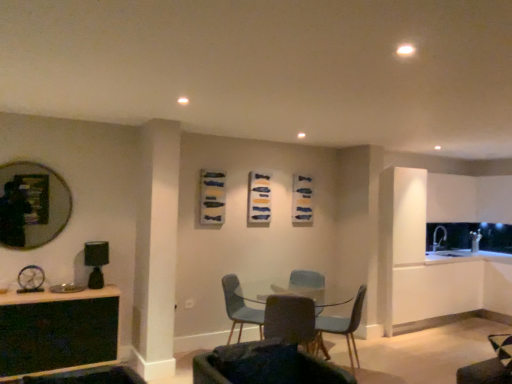
Question: Considering the positions of point (280, 329) and point (252, 301), is point (280, 329) closer or farther from the camera than point (252, 301)?

Choices:
 (A) farther
 (B) closer

Answer: (B)

Question: Looking at the image, does matte gray chair at center, which is the third chair from back to front, seem bigger or smaller compared to matte blue chair at center, which ranks as the first chair in back-to-front order?

Choices:
 (A) small
 (B) big

Answer: (A)

Question: Based on their relative distances, which object is farther from the dark gray fabric chair at center, which is counted as the 4th chair, starting from the back?

Choices:
 (A) matte gray chair at center, which is the third chair from back to front
 (B) black glass table at lower left
 (C) black matte lamp at left
 (D) matte blue chair at center, the 2th chair when ordered from back to front
 (E) clear glass table at center

Answer: (C)

Question: Estimate the real-world distances between objects in this image. Which object is closer to the black matte lamp at left?

Choices:
 (A) clear glass table at center
 (B) dark gray fabric chair at center, which is counted as the 4th chair, starting from the back
 (C) matte gray chair at center, the 2th chair from the front
 (D) matte black mirror at left
 (E) black glass table at lower left

Answer: (E)